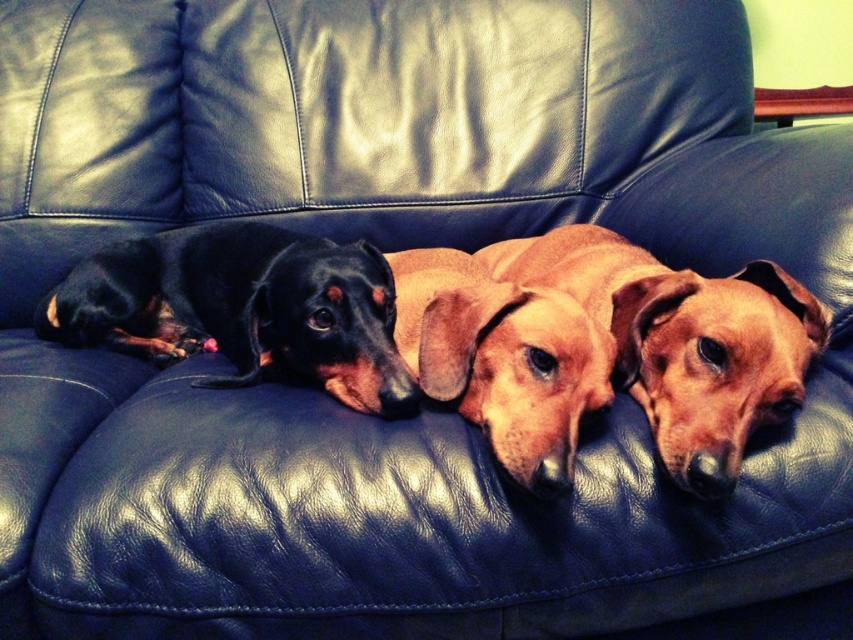
You are a dog trainer observing the brown matte dog at center and the black smooth dachshund at left. Which dog is closer to the backrest of the couch?

The black smooth dachshund at left is closer to the backrest of the couch because the brown matte dog at center is positioned under it, meaning the black smooth dachshund is above and closer to the backrest.

You are a photographer positioned in front of the couch. You want to take a closeup shot of the brown matte dog at center. Considering your current position, can you estimate how far you need to move forward to get a clear closeup without moving the dog?

The brown matte dog at center is 30.24 inches away from viewer. To get a clear closeup, you need to move forward approximately 30.24 inches closer to the dog.

You are a pet sitter who needs to ensure all dogs have enough space on the couch. Given that the black smooth dachshund at left is smaller, will the brown matte dog at center require more space to lie comfortably?

Yes, the brown matte dog at center requires more space because it is larger in size compared to the black smooth dachshund at left.